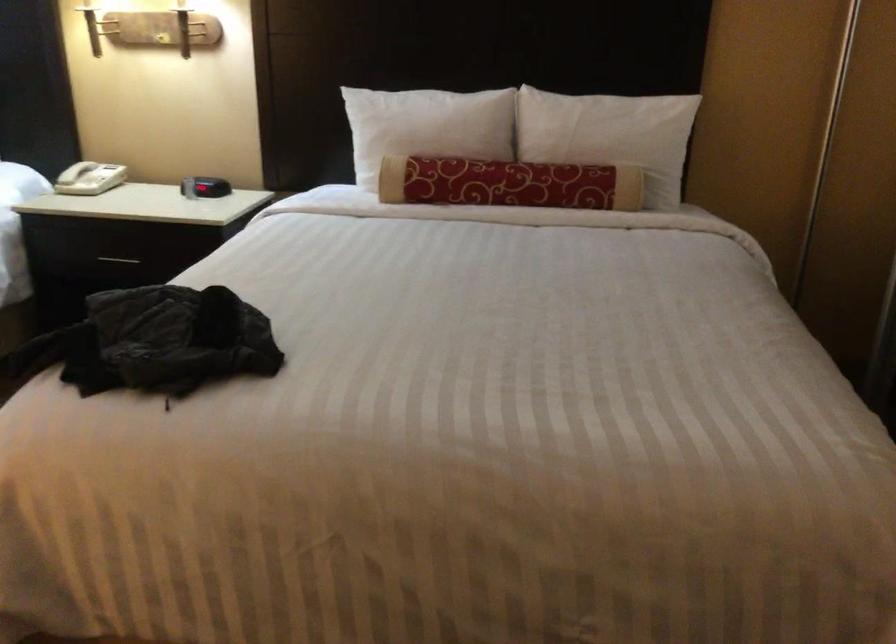
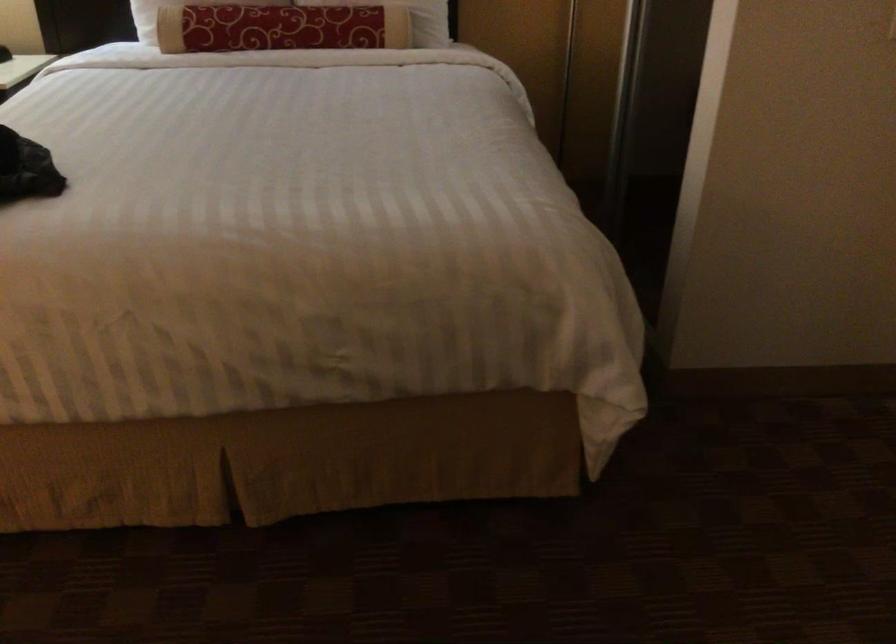
The images are taken continuously from a first-person perspective. In which direction are you moving?

The cameraman walked toward right, backward.